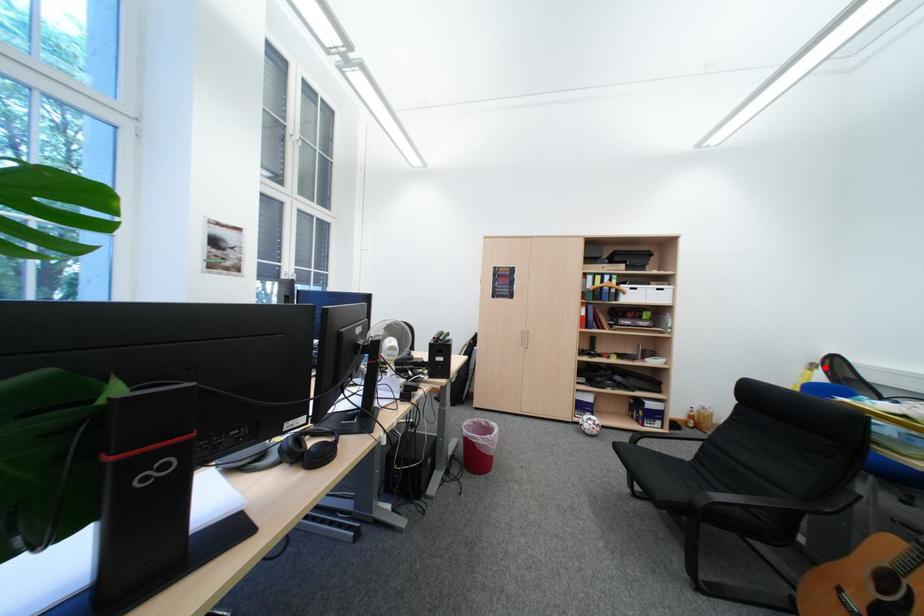
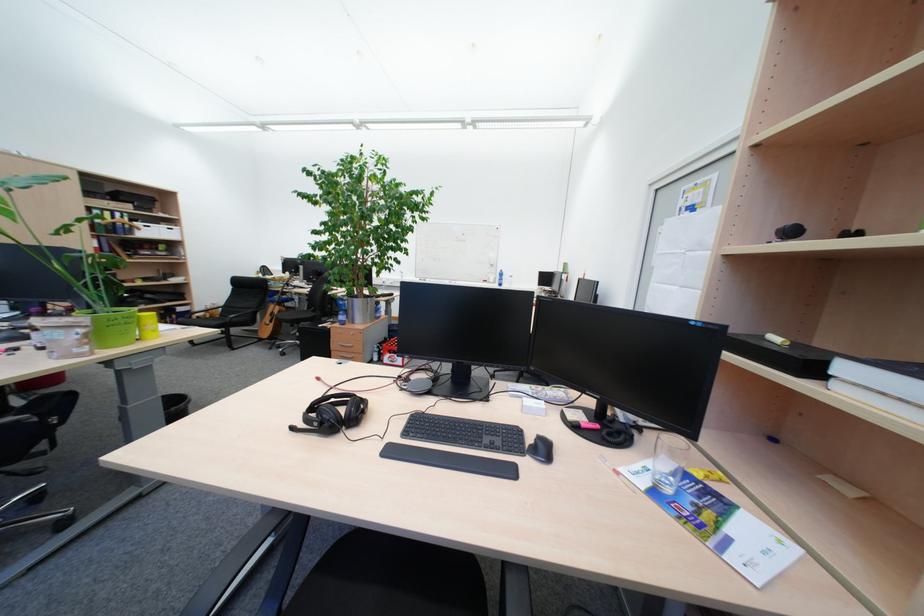
The point at the highlighted location is marked in the first image. Where is the corresponding point in the second image?

(271, 274)